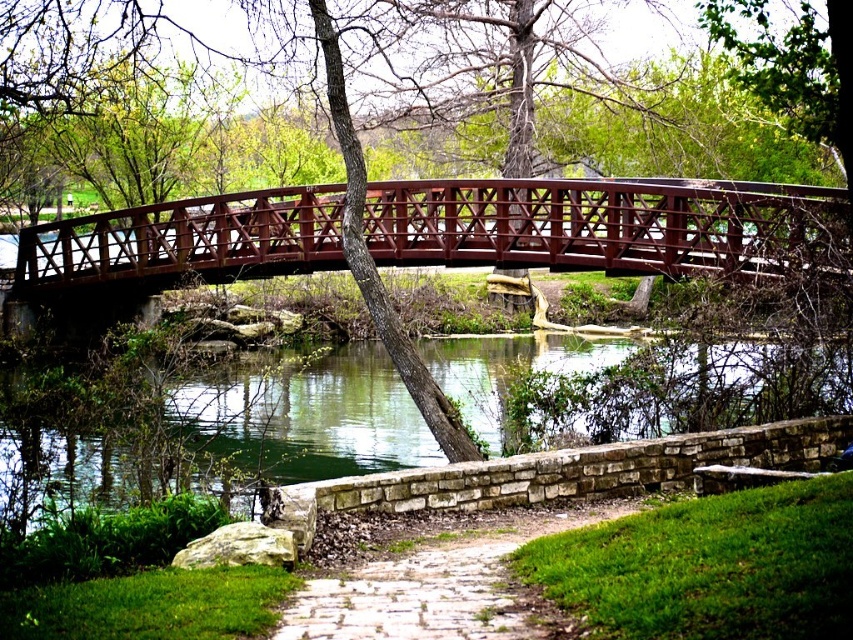
Does metallic red bridge at center have a greater height compared to green water at lower center?

Indeed, metallic red bridge at center has a greater height compared to green water at lower center.

Who is more forward, (828,250) or (384,392)?

Point (828,250) is in front.

Between point (758, 230) and point (67, 474), which one is positioned behind?

The point (758, 230) is more distant.

Locate an element on the screen. Image resolution: width=853 pixels, height=640 pixels. metallic red bridge at center is located at coordinates (599, 224).

Between green water at lower center and white stone path at center, which one appears on the left side from the viewer's perspective?

From the viewer's perspective, white stone path at center appears more on the left side.

Does green water at lower center appear over white stone path at center?

Correct, green water at lower center is located above white stone path at center.

Locate an element on the screen. The image size is (853, 640). green water at lower center is located at coordinates (306, 416).

Locate an element on the screen. The height and width of the screenshot is (640, 853). green water at lower center is located at coordinates (x=306, y=416).

Does metallic red bridge at center have a larger size compared to white stone path at center?

Yes, metallic red bridge at center is bigger than white stone path at center.

Does metallic red bridge at center have a lesser height compared to white stone path at center?

No, metallic red bridge at center is not shorter than white stone path at center.

Is point (91, 236) behind point (456, 554)?

Yes, point (91, 236) is farther from viewer.

At what (x,y) coordinates should I click in order to perform the action: click on metallic red bridge at center. Please return your answer as a coordinate pair (x, y). This screenshot has width=853, height=640. Looking at the image, I should click on (599, 224).